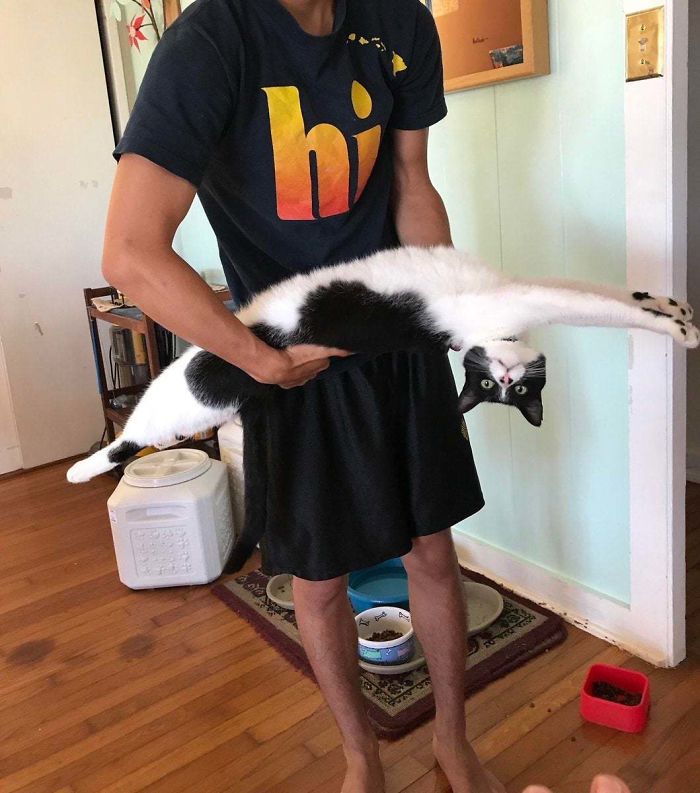
At what (x,y) coordinates should I click in order to perform the action: click on bin. Please return your answer as a coordinate pair (x, y). The image size is (700, 793). Looking at the image, I should click on (174, 523).